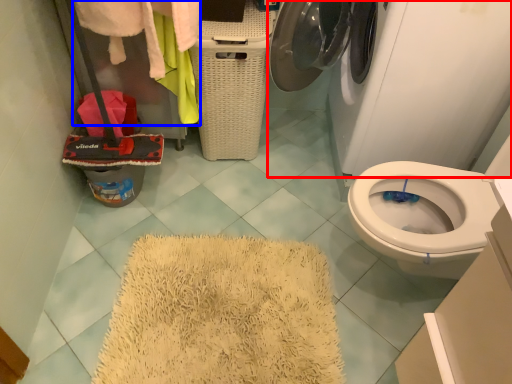
Question: Which object is closer to the camera taking this photo, washing machine (highlighted by a red box) or clothing (highlighted by a blue box)?

Choices:
 (A) washing machine
 (B) clothing

Answer: (A)